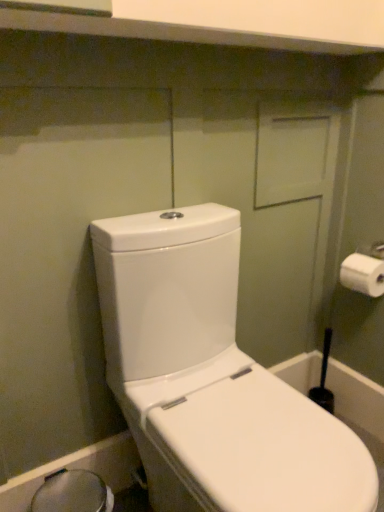
Question: Does transparent plastic bidet at lower left have a greater width compared to white glossy toilet at left?

Choices:
 (A) yes
 (B) no

Answer: (B)

Question: Can you confirm if transparent plastic bidet at lower left is shorter than white glossy toilet at left?

Choices:
 (A) yes
 (B) no

Answer: (A)

Question: Does transparent plastic bidet at lower left lie in front of white glossy toilet at left?

Choices:
 (A) no
 (B) yes

Answer: (A)

Question: Is white glossy toilet at left a part of transparent plastic bidet at lower left?

Choices:
 (A) yes
 (B) no

Answer: (B)

Question: Is transparent plastic bidet at lower left bigger than white glossy toilet at left?

Choices:
 (A) yes
 (B) no

Answer: (B)

Question: Does transparent plastic bidet at lower left touch white glossy toilet at left?

Choices:
 (A) no
 (B) yes

Answer: (A)

Question: From the image's perspective, is transparent plastic bidet at lower left below white matte toilet paper at right?

Choices:
 (A) no
 (B) yes

Answer: (B)

Question: Is transparent plastic bidet at lower left shorter than white matte toilet paper at right?

Choices:
 (A) yes
 (B) no

Answer: (B)

Question: From a real-world perspective, is transparent plastic bidet at lower left under white matte toilet paper at right?

Choices:
 (A) yes
 (B) no

Answer: (A)

Question: From a real-world perspective, is transparent plastic bidet at lower left positioned over white matte toilet paper at right based on gravity?

Choices:
 (A) no
 (B) yes

Answer: (A)

Question: Can you confirm if transparent plastic bidet at lower left is bigger than white matte toilet paper at right?

Choices:
 (A) no
 (B) yes

Answer: (B)

Question: Does transparent plastic bidet at lower left appear on the right side of white matte toilet paper at right?

Choices:
 (A) yes
 (B) no

Answer: (B)

Question: Does white matte toilet paper at right have a lesser height compared to transparent plastic bidet at lower left?

Choices:
 (A) no
 (B) yes

Answer: (B)